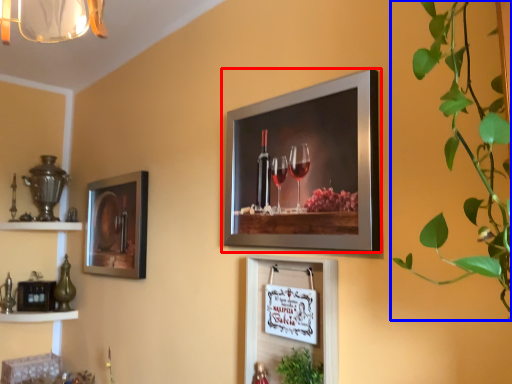
Question: Among these objects, which one is nearest to the camera, picture frame (highlighted by a red box) or houseplant (highlighted by a blue box)?

Choices:
 (A) picture frame
 (B) houseplant

Answer: (B)